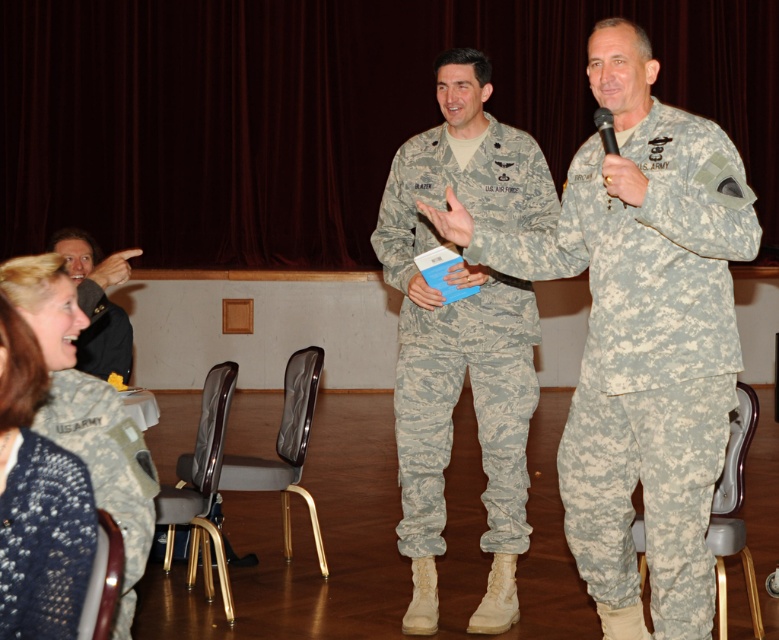
Question: Among these objects, which one is nearest to the camera?

Choices:
 (A) camouflage fabric uniform at right
 (B) camouflage fabric uniform at center
 (C) knitted blue sweater at lower left
 (D) dark gray uniform at upper left

Answer: (C)

Question: Among these points, which one is farthest from the camera?

Choices:
 (A) (122, 368)
 (B) (587, 337)
 (C) (94, 300)

Answer: (A)

Question: Is knitted blue sweater at lower left bigger than dark gray uniform at upper left?

Choices:
 (A) no
 (B) yes

Answer: (A)

Question: Which point is closer to the camera?

Choices:
 (A) (97, 320)
 (B) (86, 477)

Answer: (B)

Question: Where is camouflage fabric uniform at right located in relation to dark blue fabric jacket at left in the image?

Choices:
 (A) right
 (B) left

Answer: (A)

Question: Is camouflage fabric uniform at lower left above dark gray uniform at upper left?

Choices:
 (A) no
 (B) yes

Answer: (A)